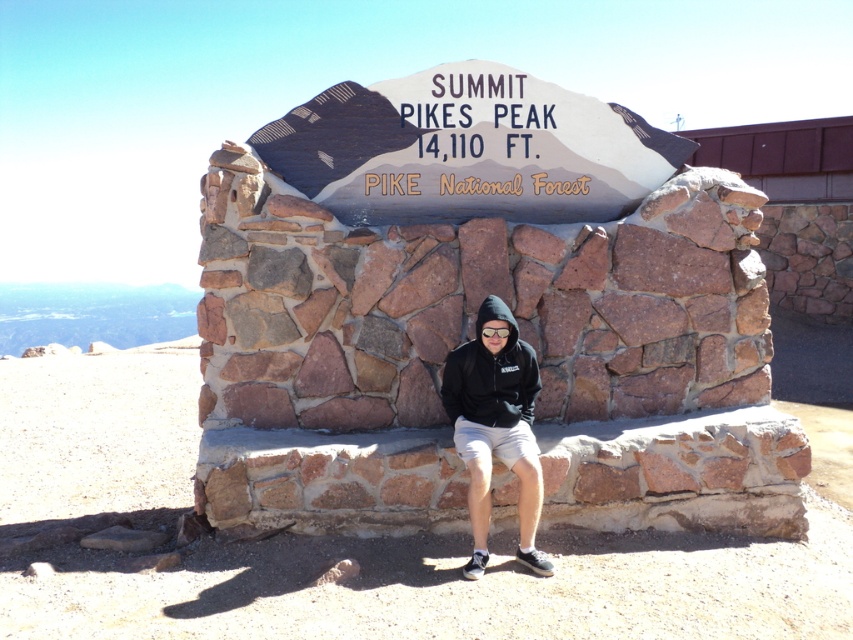
You are standing at the base of Pikes Peak and want to reach the summit bench. A drone is available for aerial photography. The point at coordinates point (474, 426) is part of the path. Can the drone safely fly over this point without getting too close to the ground?

The distance of point (474, 426) from camera is 4.11 meters. Since the drone needs to maintain a safe altitude above the ground, it can fly over the point as long as it stays above 4.11 meters to avoid obstacles.

You are a hiker who has just reached the summit of Pikes Peak. You see a black hoodie at center. Where is the black hoodie located in relation to the stone bench?

The black hoodie at center is located at point (x=495, y=426), which is on the stone bench at the summit of Pikes Peak.

You are a hiker who wants to put on a warm layer. You see a black hoodie at center and a black fleece sweatshirt at center. Which one should you put on first?

The black fleece sweatshirt at center should be put on first because the black hoodie at center is positioned under it, indicating it is the outer layer.